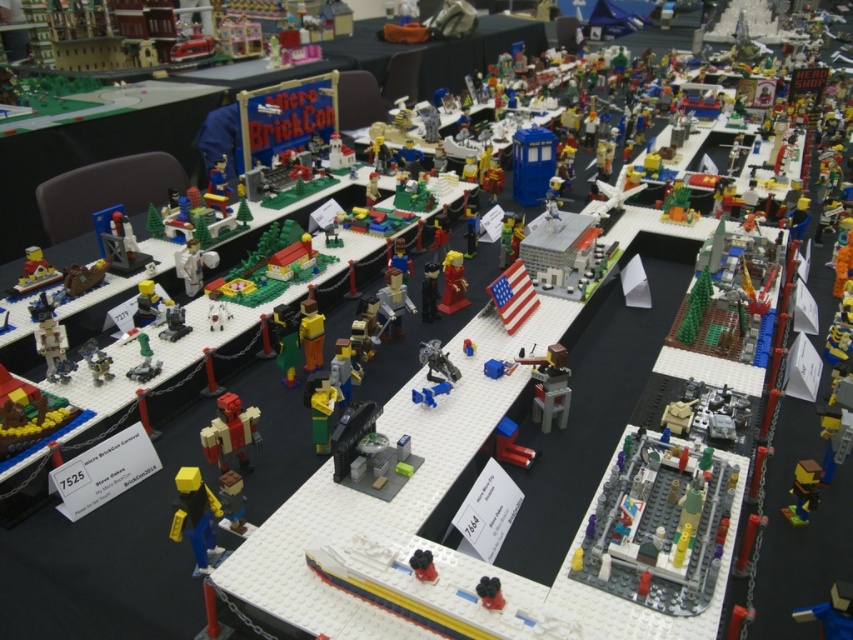
In the scene shown: You are a LEGO enthusiast attending Micro BrickCon and you see the yellow plastic figure at center and the blue plastic toy at lower right. Which one is located to the left of the other?

The yellow plastic figure at center is positioned on the left side of blue plastic toy at lower right.

You are a LEGO enthusiast standing at the entrance of Micro BrickCon. You see the yellow plastic figure at center. Can you reach out and touch it without moving your feet?

The yellow plastic figure at center and viewer are 3.35 feet apart, so yes, you can reach out and touch it without moving your feet since the distance is within typical arm reach.